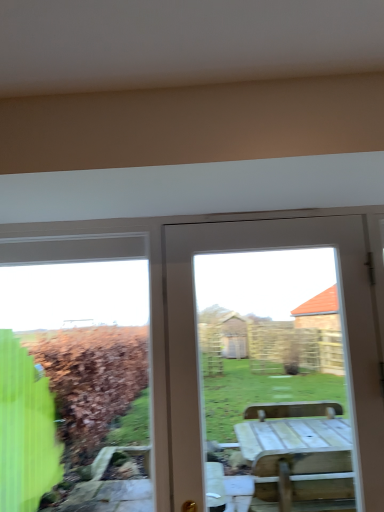
Where is `green glass window at left`? green glass window at left is located at coordinates (76, 314).

What do you see at coordinates (76, 314) in the screenshot?
I see `green glass window at left` at bounding box center [76, 314].

What is the approximate height of white wood door at center?

It is 3.42 feet.

This screenshot has height=512, width=384. What do you see at coordinates (196, 344) in the screenshot? I see `white wood door at center` at bounding box center [196, 344].

Identify the location of white wood door at center. This screenshot has width=384, height=512. (196, 344).

Identify the location of green glass window at left. (76, 314).

Which object is positioned more to the left, white wood door at center or green glass window at left?

Positioned to the left is green glass window at left.

Who is more distant, white wood door at center or green glass window at left?

Positioned behind is green glass window at left.

Is point (258, 238) positioned behind point (89, 417)?

No, (258, 238) is in front of (89, 417).

From the image's perspective, is white wood door at center above or below green glass window at left?

From the image's perspective, white wood door at center appears above green glass window at left.

From a real-world perspective, is white wood door at center on green glass window at left?

Yes, from a real-world perspective, white wood door at center is above green glass window at left.

Between white wood door at center and green glass window at left, which one has smaller width?

Thinner between the two is green glass window at left.

Can you confirm if white wood door at center is shorter than green glass window at left?

No, white wood door at center is not shorter than green glass window at left.

Who is smaller, white wood door at center or green glass window at left?

Smaller between the two is green glass window at left.

Do you think white wood door at center is within green glass window at left, or outside of it?

white wood door at center is not enclosed by green glass window at left.

Are white wood door at center and green glass window at left making contact?

No, white wood door at center is not making contact with green glass window at left.

Could you tell me if white wood door at center is turned towards green glass window at left?

No, white wood door at center is not facing towards green glass window at left.

The image size is (384, 512). Identify the location of door that appears in front of the green glass window at left. coord(196,344).

Considering the relative positions of green glass window at left and white wood door at center in the image provided, is green glass window at left to the left or to the right of white wood door at center?

green glass window at left is to the left of white wood door at center.

Which is in front, green glass window at left or white wood door at center?

white wood door at center is closer to the camera.

Considering the positions of points (62, 429) and (372, 490), is point (62, 429) farther from camera compared to point (372, 490)?

Yes, it is.

From the image's perspective, between green glass window at left and white wood door at center, which one is located above?

white wood door at center, from the image's perspective.

From a real-world perspective, who is located lower, green glass window at left or white wood door at center?

From a 3D spatial view, green glass window at left is below.

Between green glass window at left and white wood door at center, which one has larger width?

Wider between the two is white wood door at center.

Is green glass window at left taller or shorter than white wood door at center?

green glass window at left is shorter than white wood door at center.

Looking at the image, does green glass window at left seem bigger or smaller compared to white wood door at center?

Considering their sizes, green glass window at left takes up less space than white wood door at center.

Is white wood door at center inside green glass window at left?

No.

Is green glass window at left with white wood door at center?

green glass window at left and white wood door at center are clearly separated.

Is green glass window at left looking in the opposite direction of white wood door at center?

No.

How far apart are green glass window at left and white wood door at center?

A distance of 11.54 feet exists between green glass window at left and white wood door at center.

This screenshot has width=384, height=512. Find the location of `bay window below the white wood door at center (from the image's perspective)`. bay window below the white wood door at center (from the image's perspective) is located at coordinates coord(76,314).

In order to click on bay window that is under the white wood door at center (from a real-world perspective) in this screenshot , I will do `click(76, 314)`.

The image size is (384, 512). Identify the location of door that is above the green glass window at left (from a real-world perspective). (196, 344).